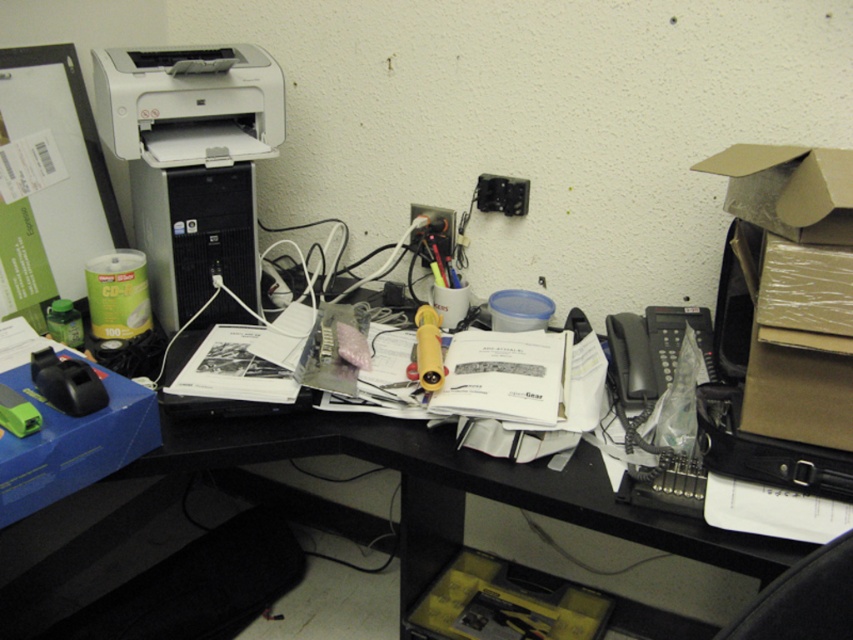
Can you confirm if white matte printer at upper left is positioned to the right of black plastic telephone at right?

In fact, white matte printer at upper left is to the left of black plastic telephone at right.

Is point (158, 124) closer to viewer compared to point (654, 346)?

No, it is behind (654, 346).

Identify the location of white matte printer at upper left. The height and width of the screenshot is (640, 853). (189, 104).

This screenshot has width=853, height=640. I want to click on white matte printer at upper left, so click(x=189, y=104).

Is silver/black plastic desktop computer at center-left wider than black plastic computer at upper left?

No, silver/black plastic desktop computer at center-left is not wider than black plastic computer at upper left.

Between point (186, 307) and point (596, 493), which one is positioned in front?

Point (596, 493) is more forward.

The image size is (853, 640). Describe the element at coordinates (193, 234) in the screenshot. I see `silver/black plastic desktop computer at center-left` at that location.

The width and height of the screenshot is (853, 640). I want to click on silver/black plastic desktop computer at center-left, so click(x=193, y=234).

Is white matte printer at upper left thinner than black plastic computer at upper left?

Indeed, white matte printer at upper left has a lesser width compared to black plastic computer at upper left.

Is white matte printer at upper left smaller than black plastic computer at upper left?

Yes, white matte printer at upper left is smaller than black plastic computer at upper left.

Where is `white matte printer at upper left`? The width and height of the screenshot is (853, 640). white matte printer at upper left is located at coordinates (189, 104).